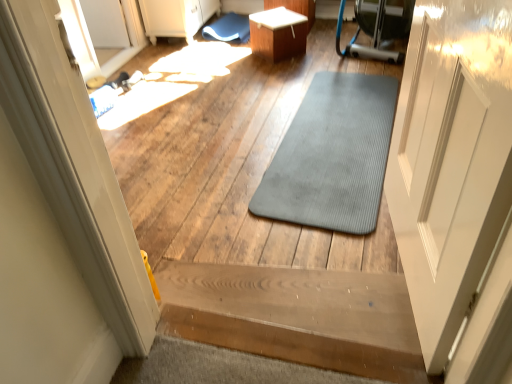
Question: Would you say transparent glass door at upper left is outside wooden stairs at center?

Choices:
 (A) yes
 (B) no

Answer: (A)

Question: From a real-world perspective, is transparent glass door at upper left located higher than wooden stairs at center?

Choices:
 (A) yes
 (B) no

Answer: (A)

Question: Is transparent glass door at upper left wider than wooden stairs at center?

Choices:
 (A) yes
 (B) no

Answer: (B)

Question: Does transparent glass door at upper left have a smaller size compared to wooden stairs at center?

Choices:
 (A) yes
 (B) no

Answer: (B)

Question: Is transparent glass door at upper left thinner than wooden stairs at center?

Choices:
 (A) no
 (B) yes

Answer: (B)

Question: Is white glossy table at upper center wider or thinner than gray rubber mat at center?

Choices:
 (A) thin
 (B) wide

Answer: (A)

Question: From the image's perspective, is white glossy table at upper center above or below gray rubber mat at center?

Choices:
 (A) above
 (B) below

Answer: (A)

Question: In terms of size, does white glossy table at upper center appear bigger or smaller than gray rubber mat at center?

Choices:
 (A) small
 (B) big

Answer: (B)

Question: From their relative heights in the image, would you say white glossy table at upper center is taller or shorter than gray rubber mat at center?

Choices:
 (A) tall
 (B) short

Answer: (A)

Question: From the image's perspective, is gray rubber mat at center positioned above or below white glossy table at upper center?

Choices:
 (A) above
 (B) below

Answer: (B)

Question: Looking at the image, does gray rubber mat at center seem bigger or smaller compared to white glossy table at upper center?

Choices:
 (A) small
 (B) big

Answer: (A)

Question: Is gray rubber mat at center situated inside white glossy table at upper center or outside?

Choices:
 (A) inside
 (B) outside

Answer: (B)

Question: Considering the positions of gray rubber mat at center and white glossy table at upper center in the image, is gray rubber mat at center wider or thinner than white glossy table at upper center?

Choices:
 (A) wide
 (B) thin

Answer: (A)

Question: From the image's perspective, is gray rubber mat at center positioned above or below wooden stairs at center?

Choices:
 (A) above
 (B) below

Answer: (A)

Question: In the image, is gray rubber mat at center positioned in front of or behind wooden stairs at center?

Choices:
 (A) behind
 (B) front

Answer: (A)